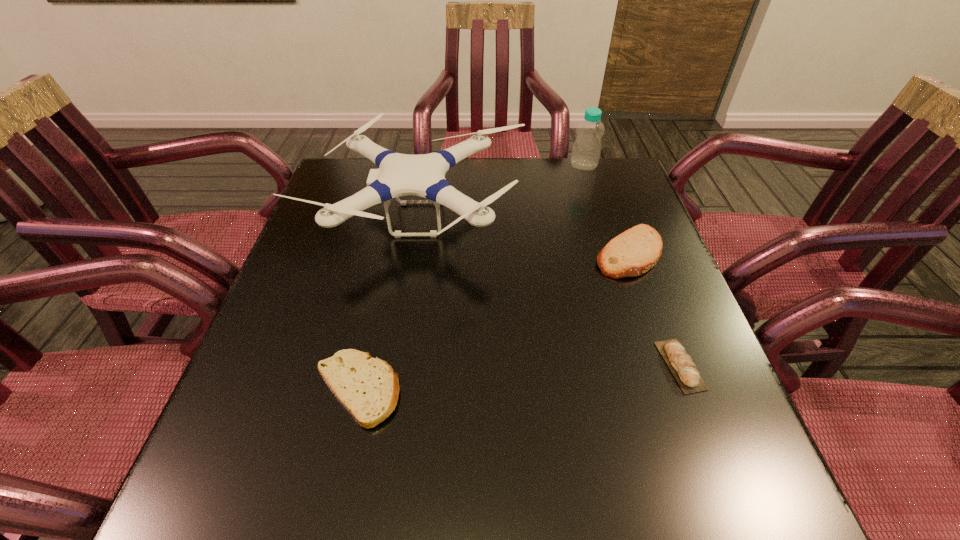
Locate an element on the screen. Image resolution: width=960 pixels, height=540 pixels. drone positioned at the far edge is located at coordinates (423, 175).

Identify the location of drone at the left edge. The width and height of the screenshot is (960, 540). click(423, 175).

At what (x,y) coordinates should I click in order to perform the action: click on pita bread that is at the left edge. Please return your answer as a coordinate pair (x, y). Looking at the image, I should click on (368, 388).

In order to click on bottle that is at the right edge in this screenshot , I will do `click(586, 150)`.

Identify the location of object located in the far left corner section of the desktop. This screenshot has height=540, width=960. (423, 175).

The height and width of the screenshot is (540, 960). Find the location of `object present at the far right corner`. object present at the far right corner is located at coordinates (586, 150).

In the image, there is a desktop. Where is `free space at the far edge`? free space at the far edge is located at coordinates (487, 173).

This screenshot has width=960, height=540. In order to click on free spot at the near edge of the desktop in this screenshot , I will do `click(584, 501)`.

The width and height of the screenshot is (960, 540). Find the location of `free space at the left edge`. free space at the left edge is located at coordinates (314, 397).

You are a GUI agent. You are given a task and a screenshot of the screen. Output one action in this format:
    pyautogui.click(x=<x>, y=<y>)
    Task: Click on the vacant point at the right edge
    
    Given the screenshot: What is the action you would take?
    pyautogui.click(x=612, y=224)